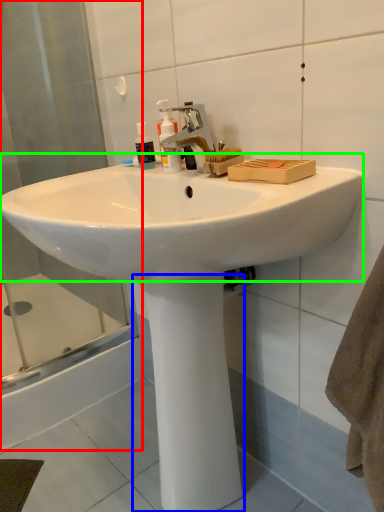
Question: Which object is positioned closest to shower door (highlighted by a red box)? Select from pillar (highlighted by a blue box) and sink (highlighted by a green box).

Choices:
 (A) pillar
 (B) sink

Answer: (B)